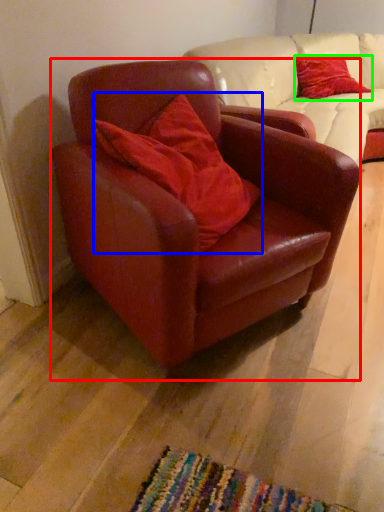
Question: Estimate the real-world distances between objects in this image. Which object is farther from chair (highlighted by a red box), pillow (highlighted by a blue box) or pillow (highlighted by a green box)?

Choices:
 (A) pillow
 (B) pillow

Answer: (B)